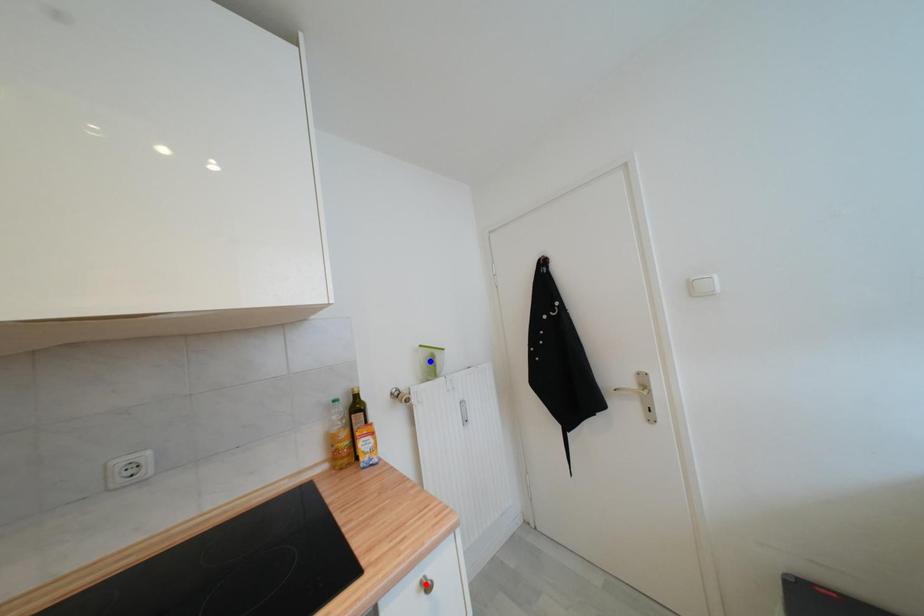
Question: Which of the two points in the image is closer to the camera?

Choices:
 (A) Blue point is closer.
 (B) Red point is closer.

Answer: (B)